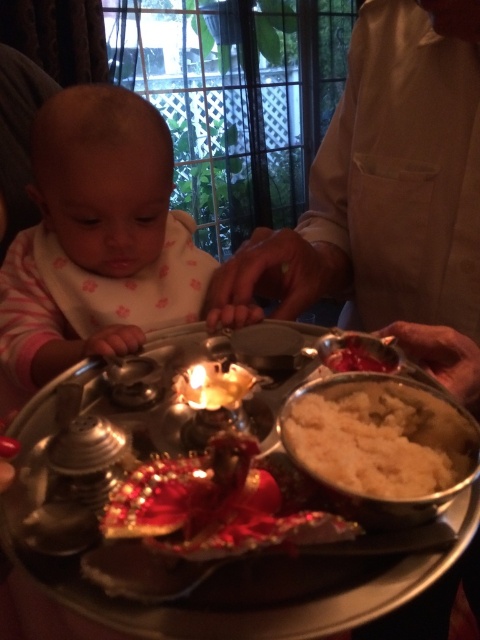
Question: Which point appears closest to the camera in this image?

Choices:
 (A) (50, 141)
 (B) (396, 397)

Answer: (B)

Question: Which of the following is the closest to the observer?

Choices:
 (A) (6, 276)
 (B) (437, 13)
 (C) (300, 419)

Answer: (C)

Question: Is light beige fabric at center positioned at the back of matte white bib at left?

Choices:
 (A) no
 (B) yes

Answer: (A)

Question: Can you confirm if light beige fabric at center is positioned below matte white bib at left?

Choices:
 (A) no
 (B) yes

Answer: (A)

Question: Is matte white bib at left positioned behind white matte rice at center?

Choices:
 (A) yes
 (B) no

Answer: (A)

Question: Which point is farther to the camera?

Choices:
 (A) (479, 129)
 (B) (115, 216)
 (C) (417, 444)

Answer: (B)